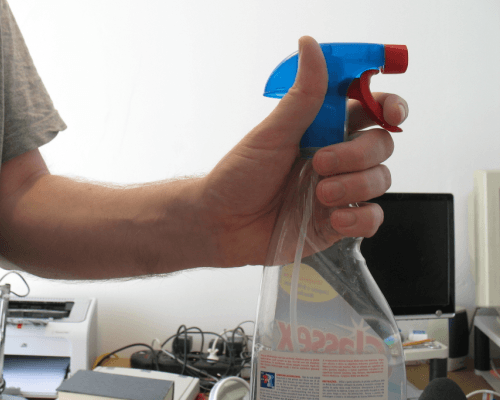
The height and width of the screenshot is (400, 500). I want to click on extention cord, so click(x=149, y=358).